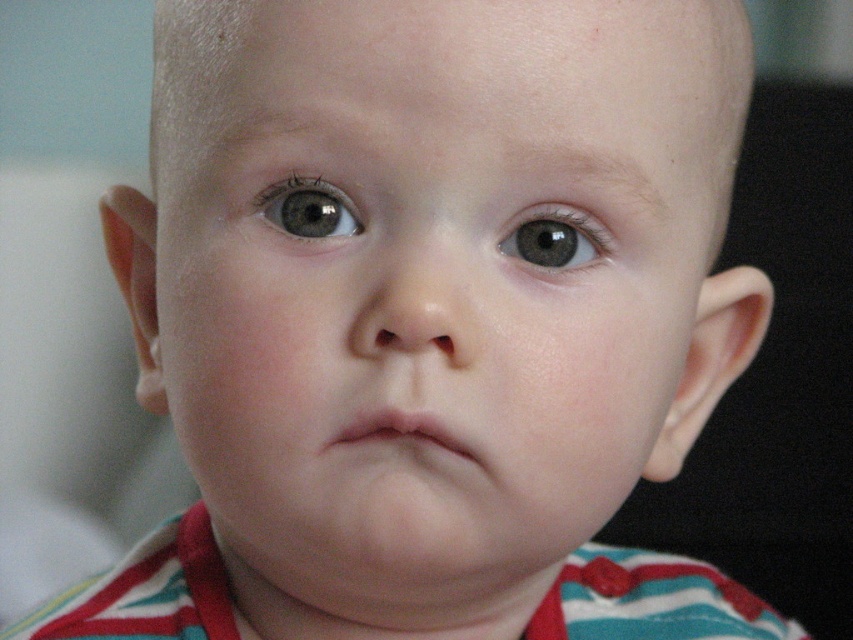
Consider the image. Can you confirm if smooth skin face at center is positioned above matte gray eye at upper center?

No.

Find the location of `smooth skin face at center`. smooth skin face at center is located at coordinates (430, 280).

Can you confirm if smooth skin face at center is taller than gray matte eye at center?

Correct, smooth skin face at center is much taller as gray matte eye at center.

Find the location of a particular element. smooth skin face at center is located at coordinates (430, 280).

Is matte gray eye at upper center above gray matte eye at center?

Correct, matte gray eye at upper center is located above gray matte eye at center.

Is matte gray eye at upper center bigger than gray matte eye at center?

Correct, matte gray eye at upper center is larger in size than gray matte eye at center.

Is point (323, 198) closer to camera compared to point (596, 256)?

Yes, point (323, 198) is closer to viewer.

Image resolution: width=853 pixels, height=640 pixels. In order to click on matte gray eye at upper center in this screenshot , I will do click(309, 209).